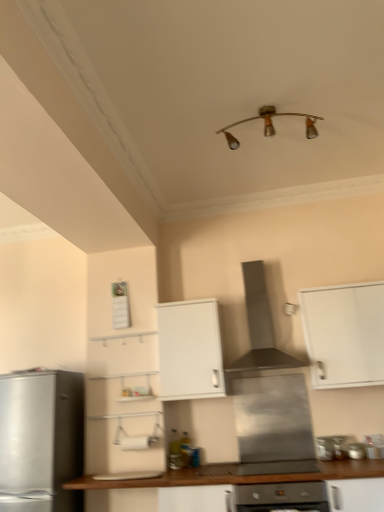
Question: In which direction should I rotate to look at stainless steel range hood at center, placed as the 1th appliance when sorted from left to right?

Choices:
 (A) right
 (B) left

Answer: (A)

Question: Is metallic silver stove at lower center, which is the 2th appliance from right to left, thinner than stainless steel range hood at center, the 3th appliance viewed from the right?

Choices:
 (A) no
 (B) yes

Answer: (B)

Question: Is metallic silver stove at lower center, which is the 2th appliance from right to left, to the left of stainless steel range hood at center, the 3th appliance viewed from the right, from the viewer's perspective?

Choices:
 (A) yes
 (B) no

Answer: (B)

Question: From a real-world perspective, is metallic silver stove at lower center, which is the 2th appliance from right to left, physically below stainless steel range hood at center, the 3th appliance viewed from the right?

Choices:
 (A) yes
 (B) no

Answer: (A)

Question: Is metallic silver stove at lower center, which is the 2th appliance from right to left, positioned before stainless steel range hood at center, the 3th appliance viewed from the right?

Choices:
 (A) yes
 (B) no

Answer: (B)

Question: From the image's perspective, would you say metallic silver stove at lower center, which ranks as the second appliance in left-to-right order, is shown under stainless steel range hood at center, placed as the 1th appliance when sorted from left to right?

Choices:
 (A) yes
 (B) no

Answer: (A)

Question: Does stainless steel range hood at center have a greater width compared to satin silver oven at center?

Choices:
 (A) yes
 (B) no

Answer: (B)

Question: From the image's perspective, is stainless steel range hood at center below satin silver oven at center?

Choices:
 (A) yes
 (B) no

Answer: (B)

Question: From a real-world perspective, is stainless steel range hood at center on top of satin silver oven at center?

Choices:
 (A) no
 (B) yes

Answer: (B)

Question: Is satin silver oven at center surrounded by stainless steel range hood at center?

Choices:
 (A) no
 (B) yes

Answer: (A)

Question: Considering the relative positions of stainless steel range hood at center and satin silver oven at center in the image provided, is stainless steel range hood at center to the left of satin silver oven at center from the viewer's perspective?

Choices:
 (A) no
 (B) yes

Answer: (B)

Question: Is stainless steel range hood at center facing towards satin silver oven at center?

Choices:
 (A) no
 (B) yes

Answer: (A)

Question: Considering the relative sizes of metallic silver stove at lower center, the 3th appliance in the left-to-right sequence, and white matte cabinet at center, which ranks as the 1th cabinetry in left-to-right order, in the image provided, is metallic silver stove at lower center, the 3th appliance in the left-to-right sequence, smaller than white matte cabinet at center, which ranks as the 1th cabinetry in left-to-right order,?

Choices:
 (A) no
 (B) yes

Answer: (B)